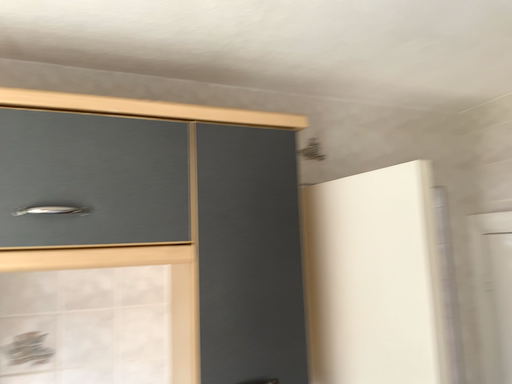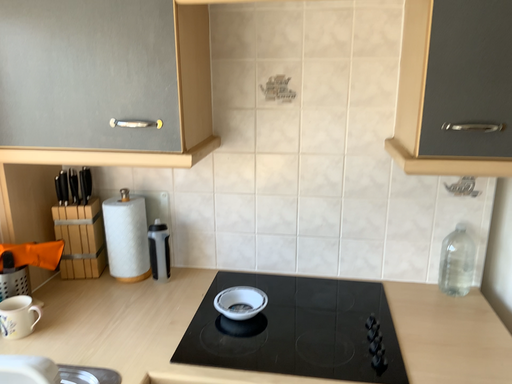
Question: How did the camera likely rotate when shooting the video?

Choices:
 (A) rotated right
 (B) rotated left

Answer: (B)